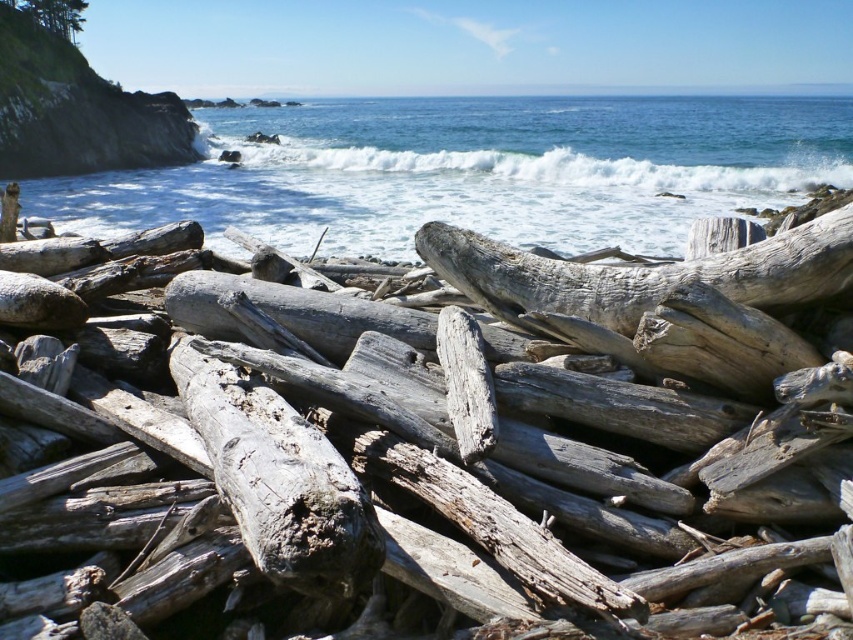
You are a photographer planning to capture the coastal scene. You want to ensure that the weathered wood log at center and the white frothy wave at upper center are both visible in your shot. Based on their sizes, which object should you frame closer to the edge of the photo to avoid overcrowding?

The weathered wood log at center has a smaller width compared to the white frothy wave at upper center. To avoid overcrowding, frame the weathered wood log at center closer to the edge of the photo since it takes up less space.

You are standing on the beach and see the weathered wood at center and the blue water at upper center. Which object takes up more space in the image?

The blue water at upper center takes up more space in the image because the weathered wood at center has a smaller size compared to it.

You are a photographer trying to capture the tallest object in the scene. Which one should you focus on between the weathered wood at center and the weathered wood log at center?

The weathered wood at center is taller than the weathered wood log at center, so you should focus on the weathered wood at center to capture the tallest object.